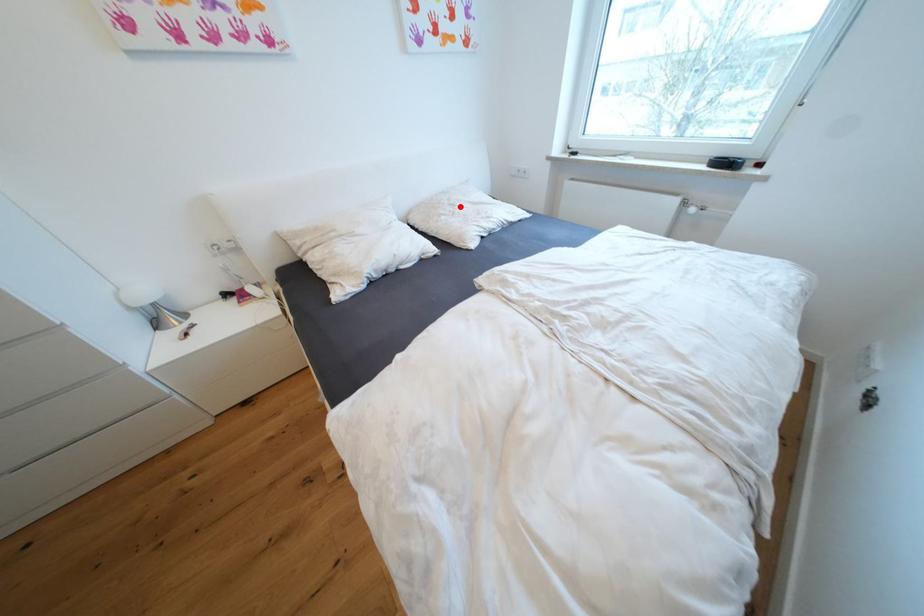
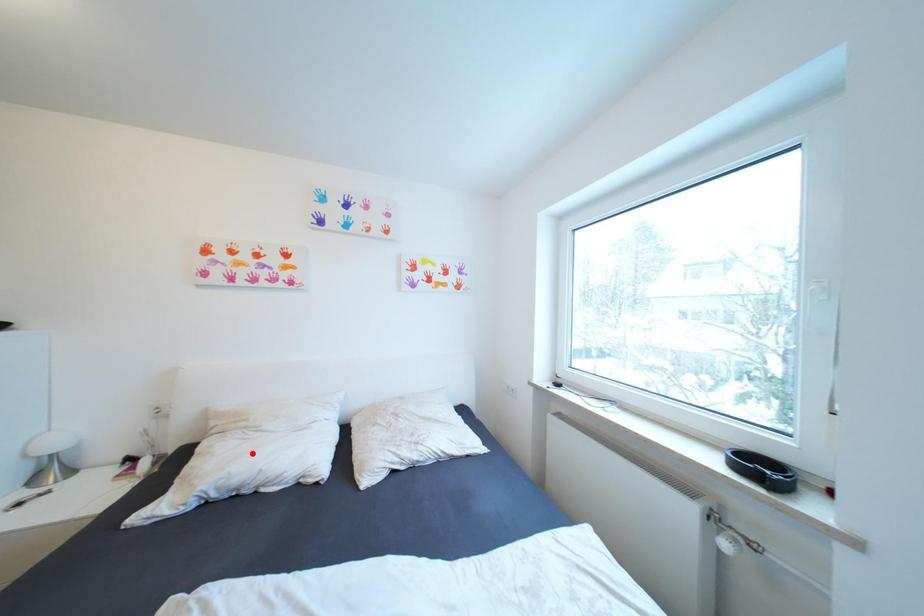
I am providing you with two images of the same scene from different viewpoints. A red point is marked on the first image and another point is marked on the second image. Are the points marked in image1 and image2 representing the same 3D position?

No